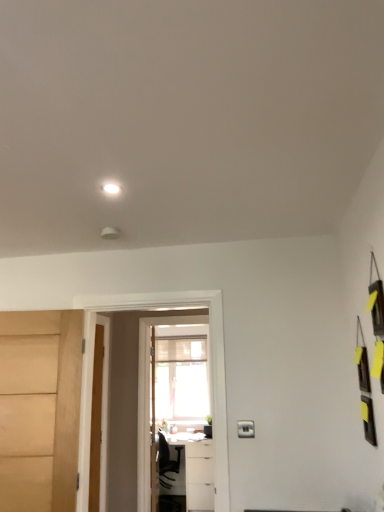
Question: In which direction should I rotate to look at wooden door at center, marked as the 3th door in a left-to-right arrangement?

Choices:
 (A) left
 (B) right

Answer: (A)

Question: Is white glossy table at lower center further to camera compared to wooden door at center, the 2th door positioned from the left?

Choices:
 (A) no
 (B) yes

Answer: (B)

Question: Is white glossy table at lower center oriented away from wooden door at center, arranged as the second door when viewed from the back?

Choices:
 (A) no
 (B) yes

Answer: (A)

Question: From a real-world perspective, is white glossy table at lower center physically above wooden door at center, the second door when ordered from right to left?

Choices:
 (A) no
 (B) yes

Answer: (A)

Question: Is white glossy table at lower center positioned before wooden door at center, the second door when ordered from right to left?

Choices:
 (A) no
 (B) yes

Answer: (A)

Question: Does white glossy table at lower center turn towards wooden door at center, the 2th door in the front-to-back sequence?

Choices:
 (A) no
 (B) yes

Answer: (B)

Question: Can you confirm if white glossy table at lower center is shorter than wooden door at center, arranged as the second door when viewed from the back?

Choices:
 (A) yes
 (B) no

Answer: (A)

Question: Is matte wood door at left, placed as the 1th door when sorted from front to back, positioned before white glossy table at lower center?

Choices:
 (A) no
 (B) yes

Answer: (B)

Question: From the image's perspective, is matte wood door at left, which ranks as the 3th door in back-to-front order, above white glossy table at lower center?

Choices:
 (A) yes
 (B) no

Answer: (A)

Question: Is matte wood door at left, positioned as the third door in right-to-left order, bigger than white glossy table at lower center?

Choices:
 (A) no
 (B) yes

Answer: (A)

Question: Is the position of matte wood door at left, which ranks as the 3th door in back-to-front order, more distant than that of white glossy table at lower center?

Choices:
 (A) yes
 (B) no

Answer: (B)

Question: Considering the relative sizes of matte wood door at left, which ranks as the 3th door in back-to-front order, and white glossy table at lower center in the image provided, is matte wood door at left, which ranks as the 3th door in back-to-front order, smaller than white glossy table at lower center?

Choices:
 (A) no
 (B) yes

Answer: (B)

Question: From a real-world perspective, is matte wood door at left, placed as the 1th door when sorted from front to back, beneath white glossy table at lower center?

Choices:
 (A) yes
 (B) no

Answer: (B)

Question: Could you tell me if wooden door at center, the 2th door in the front-to-back sequence, is turned towards transparent glass screen door at center?

Choices:
 (A) no
 (B) yes

Answer: (A)